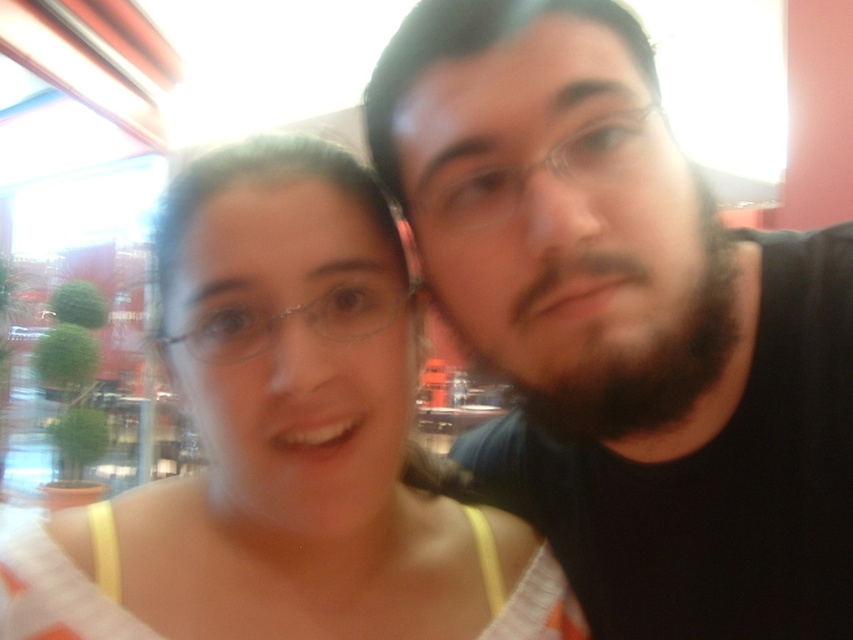
Measure the distance between black matte shirt at right and camera.

black matte shirt at right is 13.88 inches away from camera.

In order to click on black matte shirt at right in this screenshot , I will do `click(624, 324)`.

Which is in front, point (479, 272) or point (229, 563)?

Point (479, 272) is more forward.

The height and width of the screenshot is (640, 853). I want to click on black matte shirt at right, so click(x=624, y=324).